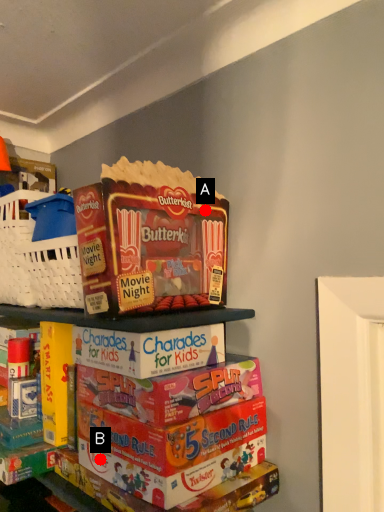
Question: Two points are circled on the image, labeled by A and B beside each circle. Which point is further to the camera?

Choices:
 (A) A is further
 (B) B is further

Answer: (A)